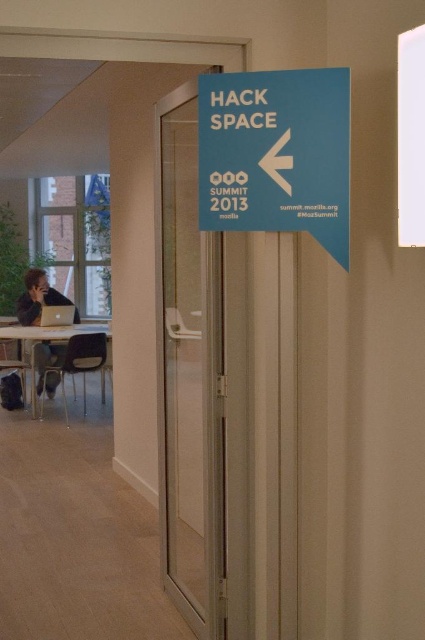
You are a visitor at the Hack Space Summit and want to enter the room through the transparent glass door at center. The silver metallic laptop at left is blocking your path. Can you step around the laptop to reach the door?

The transparent glass door at center is taller than silver metallic laptop at left, so yes, you can step around the silver metallic laptop at left to reach the transparent glass door at center since the door is higher and not obstructed by the laptop.